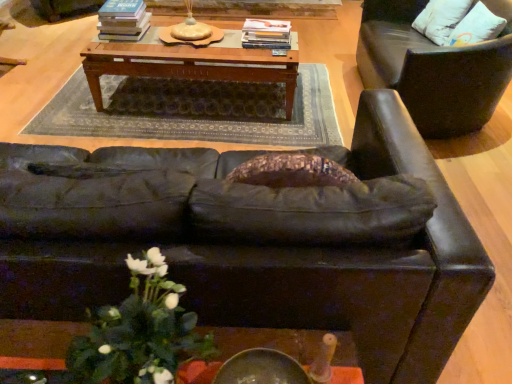
Question: Does leather chair at right touch white matte floral arrangement at lower left?

Choices:
 (A) no
 (B) yes

Answer: (A)

Question: From a real-world perspective, is leather chair at right below white matte floral arrangement at lower left?

Choices:
 (A) yes
 (B) no

Answer: (A)

Question: Is leather chair at right turned away from white matte floral arrangement at lower left?

Choices:
 (A) no
 (B) yes

Answer: (A)

Question: Is leather chair at right completely or partially outside of white matte floral arrangement at lower left?

Choices:
 (A) yes
 (B) no

Answer: (A)

Question: From the image's perspective, is leather chair at right under white matte floral arrangement at lower left?

Choices:
 (A) yes
 (B) no

Answer: (B)

Question: In the image, is hardcover book at center, which appears as the 2th book when viewed from the left, positioned in front of or behind leather chair at right?

Choices:
 (A) behind
 (B) front

Answer: (A)

Question: From the image's perspective, is hardcover book at center, which appears as the 2th book when viewed from the left, above or below leather chair at right?

Choices:
 (A) above
 (B) below

Answer: (A)

Question: From a real-world perspective, is hardcover book at center, which appears as the 2th book when viewed from the left, above or below leather chair at right?

Choices:
 (A) above
 (B) below

Answer: (A)

Question: Looking at the image, does hardcover book at center, which appears as the 2th book when viewed from the left, seem bigger or smaller compared to leather chair at right?

Choices:
 (A) big
 (B) small

Answer: (B)

Question: From the image's perspective, relative to matte black couch at center, is white cotton pillow at upper right above or below?

Choices:
 (A) below
 (B) above

Answer: (B)

Question: In terms of height, does white cotton pillow at upper right look taller or shorter compared to matte black couch at center?

Choices:
 (A) short
 (B) tall

Answer: (A)

Question: Considering the positions of white cotton pillow at upper right and matte black couch at center in the image, is white cotton pillow at upper right bigger or smaller than matte black couch at center?

Choices:
 (A) small
 (B) big

Answer: (A)

Question: Is point (434, 11) closer or farther from the camera than point (151, 180)?

Choices:
 (A) closer
 (B) farther

Answer: (B)

Question: From the image's perspective, is hardcover books at center, the 1th book from the left, located above or below hardcover book at center, acting as the 1th book starting from the right?

Choices:
 (A) above
 (B) below

Answer: (A)

Question: Based on their sizes in the image, would you say hardcover books at center, the 1th book from the left, is bigger or smaller than hardcover book at center, which appears as the 2th book when viewed from the left?

Choices:
 (A) big
 (B) small

Answer: (A)